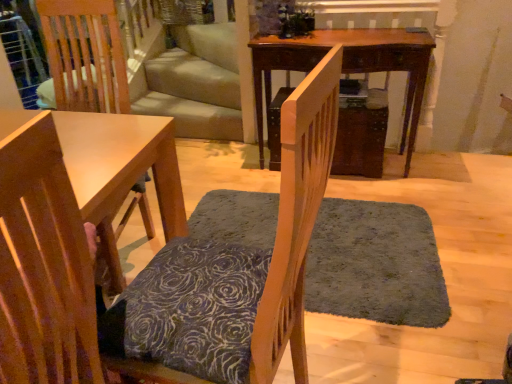
Locate an element on the screen. free space to the left of mahogany wood table at center is located at coordinates (237, 185).